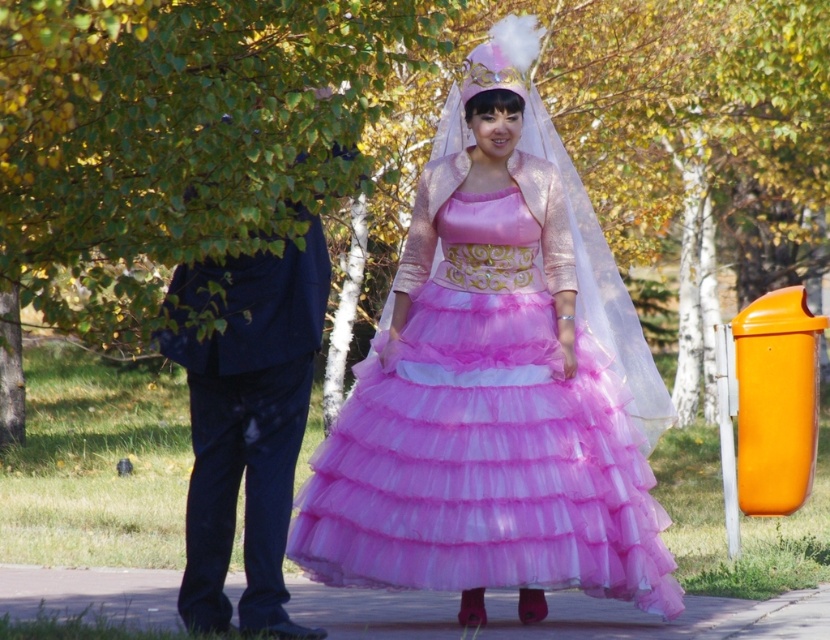
Question: Which point appears closest to the camera in this image?

Choices:
 (A) (286, 300)
 (B) (511, 362)

Answer: (A)

Question: Observing the image, what is the correct spatial positioning of matte pink tulle dress at center in reference to dark blue suit at left?

Choices:
 (A) right
 (B) left

Answer: (A)

Question: Observing the image, what is the correct spatial positioning of matte pink tulle dress at center in reference to dark blue suit at left?

Choices:
 (A) above
 (B) below

Answer: (A)

Question: Can you confirm if matte pink tulle dress at center is thinner than dark blue suit at left?

Choices:
 (A) no
 (B) yes

Answer: (A)

Question: Which point is closer to the camera taking this photo?

Choices:
 (A) (526, 96)
 (B) (238, 358)

Answer: (B)